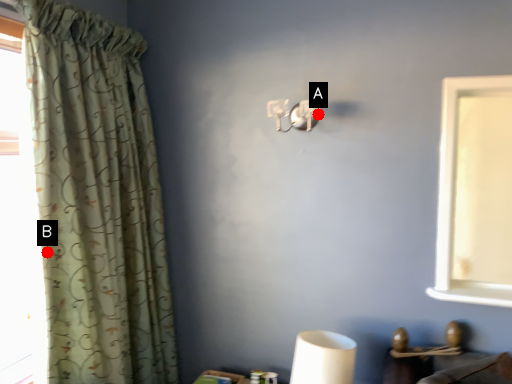
Question: Two points are circled on the image, labeled by A and B beside each circle. Which point is farther to the camera?

Choices:
 (A) A is further
 (B) B is further

Answer: (A)